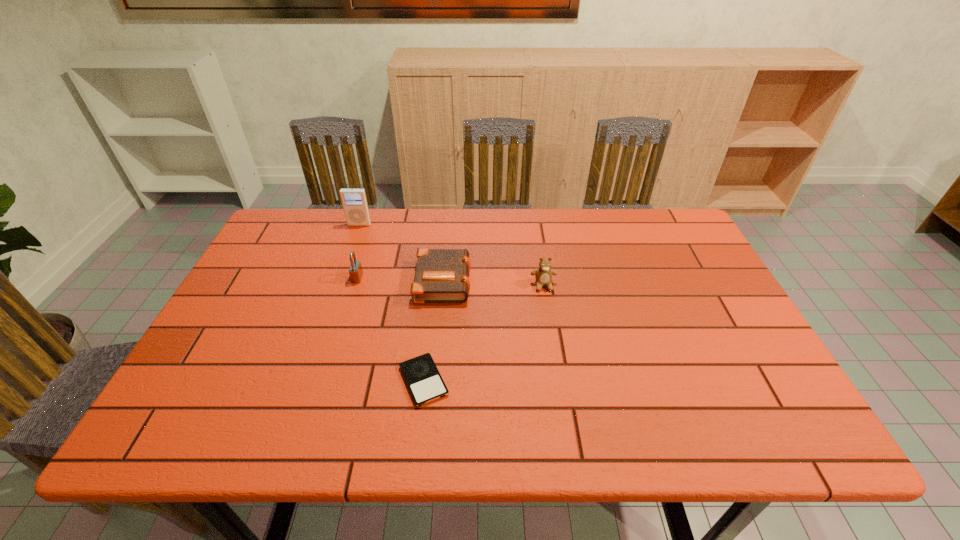
Where is `the taller iPod`? The image size is (960, 540). the taller iPod is located at coordinates (354, 201).

Where is `the tallest object`? The image size is (960, 540). the tallest object is located at coordinates (354, 201).

The height and width of the screenshot is (540, 960). Identify the location of padlock. (355, 271).

The image size is (960, 540). What are the coordinates of `the rightmost object` in the screenshot? It's located at (543, 275).

This screenshot has width=960, height=540. In order to click on Bible in this screenshot , I will do `click(442, 275)`.

This screenshot has width=960, height=540. Find the location of `the nearer iPod`. the nearer iPod is located at coordinates click(x=422, y=377).

Identify the location of the shorter iPod. (422, 377).

Locate an element on the screen. This screenshot has height=540, width=960. vacant region located on the front-facing side of the left iPod is located at coordinates (337, 291).

The width and height of the screenshot is (960, 540). I want to click on vacant area situated 0.230m on the back of the padlock, so click(x=373, y=225).

The width and height of the screenshot is (960, 540). Identify the location of free space located 0.140m on the front-facing side of the teddy bear. (551, 332).